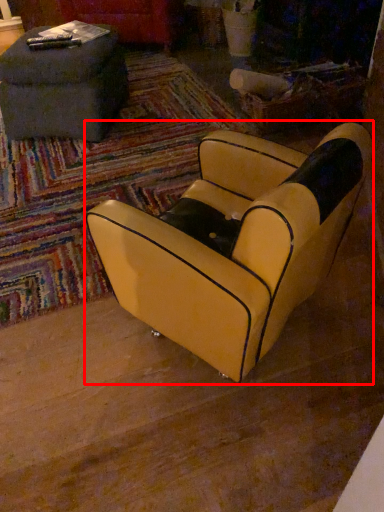
Question: Observing the image, what is the correct spatial positioning of chair (annotated by the red box) in reference to table?

Choices:
 (A) right
 (B) left

Answer: (A)